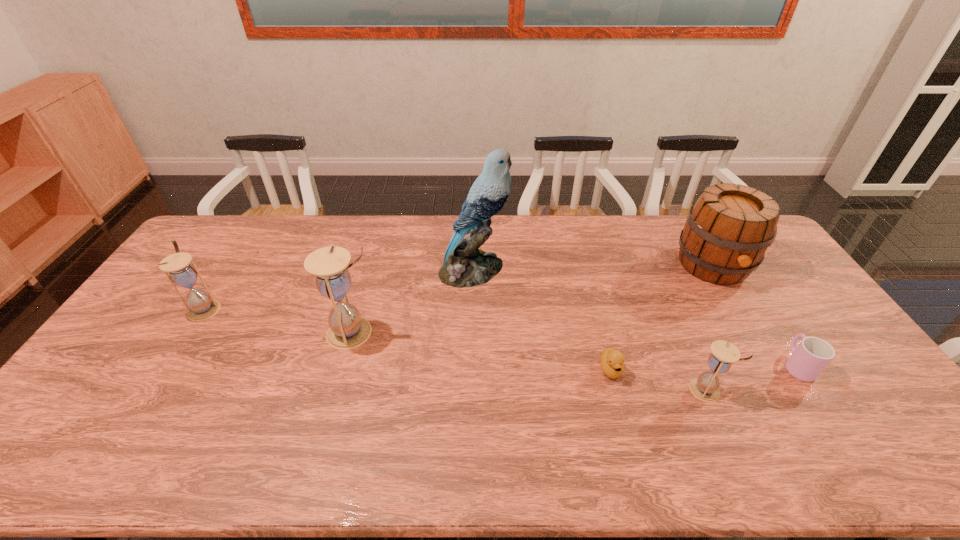
I want to click on the leftmost hourglass, so coord(201,306).

The height and width of the screenshot is (540, 960). Find the location of `the leftmost object`. the leftmost object is located at coordinates (201, 306).

I want to click on the second hourglass from right to left, so click(x=347, y=330).

Find the location of `the tallest hourglass`. the tallest hourglass is located at coordinates tap(347, 330).

Find the location of a particular element. The width and height of the screenshot is (960, 540). the shortest hourglass is located at coordinates (705, 387).

Locate an element on the screen. the rightmost hourglass is located at coordinates (705, 387).

The height and width of the screenshot is (540, 960). What are the coordinates of `cider` in the screenshot? It's located at (729, 228).

What are the coordinates of `the third object from left to right` in the screenshot? It's located at (465, 265).

Locate an element on the screen. This screenshot has height=540, width=960. parakeet is located at coordinates (465, 265).

Locate an element on the screen. cup is located at coordinates (812, 355).